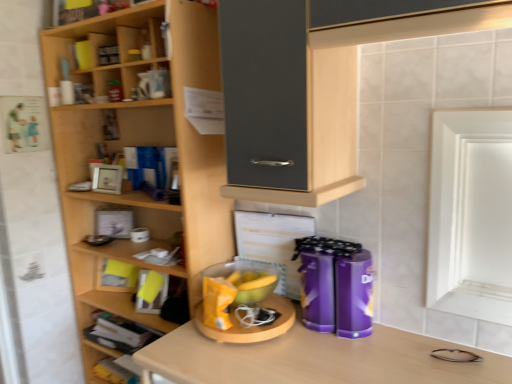
Identify the location of empty space that is ontop of purple glossy canisters at center, arranged as the first appliance when viewed from the right (from a real-world perspective). Image resolution: width=512 pixels, height=384 pixels. (334, 255).